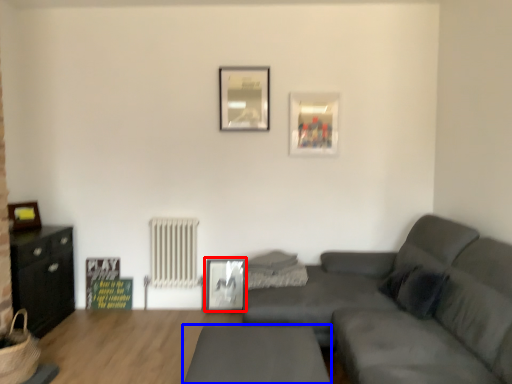
Question: Among these objects, which one is nearest to the camera, picture frame (highlighted by a red box) or table (highlighted by a blue box)?

Choices:
 (A) picture frame
 (B) table

Answer: (B)